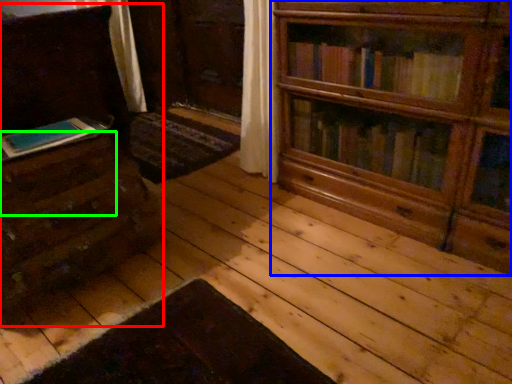
Question: Which object is positioned farthest from chest of drawers (highlighted by a red box)? Select from bookcase (highlighted by a blue box) and drawer (highlighted by a green box).

Choices:
 (A) bookcase
 (B) drawer

Answer: (A)